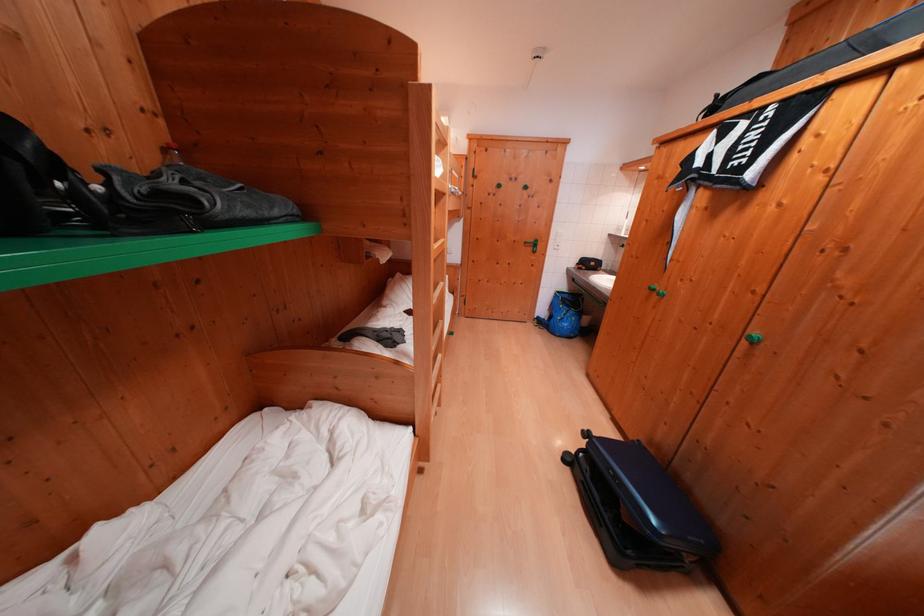
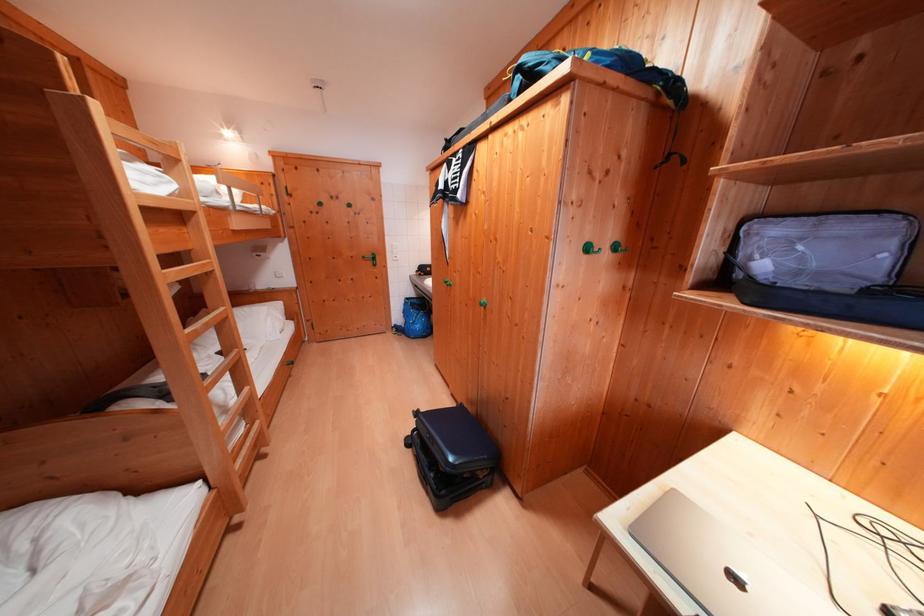
Question: The images are taken continuously from a first-person perspective. In which direction is your viewpoint rotating?

Choices:
 (A) Left
 (B) Right
 (C) Up
 (D) Down

Answer: (B)